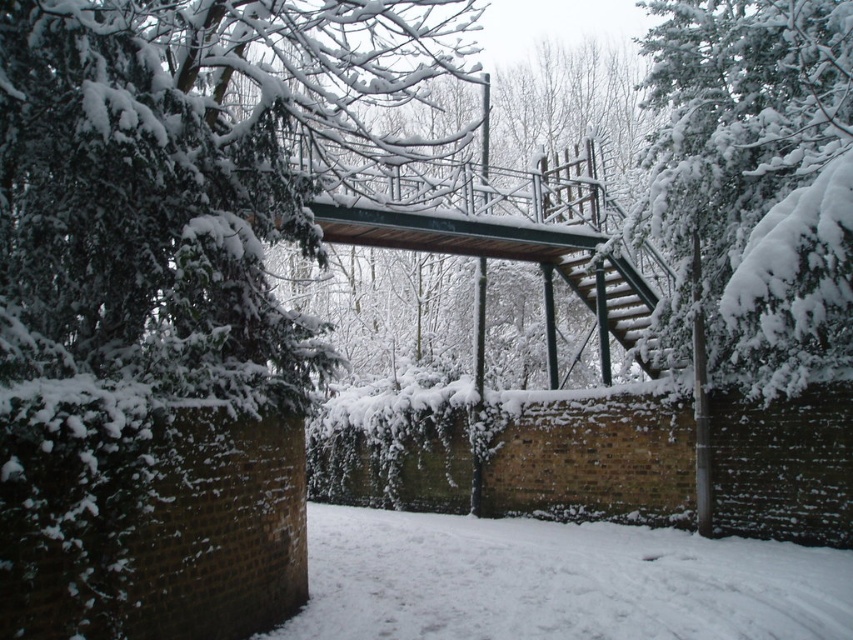
Question: Can you confirm if white powdery snow at lower center is positioned below metallic green staircase at center right?

Choices:
 (A) yes
 (B) no

Answer: (A)

Question: Which point is farther to the camera?

Choices:
 (A) metallic green staircase at center right
 (B) white powdery snow at lower center

Answer: (A)

Question: Can you confirm if white powdery snow at lower center is positioned to the left of metallic green staircase at center right?

Choices:
 (A) yes
 (B) no

Answer: (B)

Question: Can you confirm if white powdery snow at lower center is positioned to the left of metallic green staircase at center right?

Choices:
 (A) no
 (B) yes

Answer: (A)

Question: Which point appears closest to the camera in this image?

Choices:
 (A) (428, 573)
 (B) (578, 262)

Answer: (A)

Question: Which object is farther from the camera taking this photo?

Choices:
 (A) white powdery snow at lower center
 (B) metallic green staircase at center right

Answer: (B)